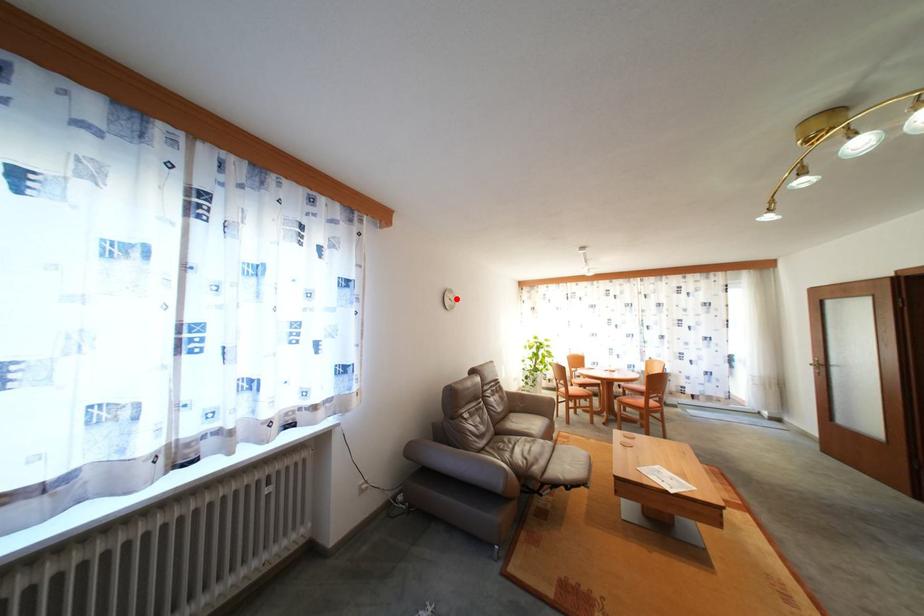
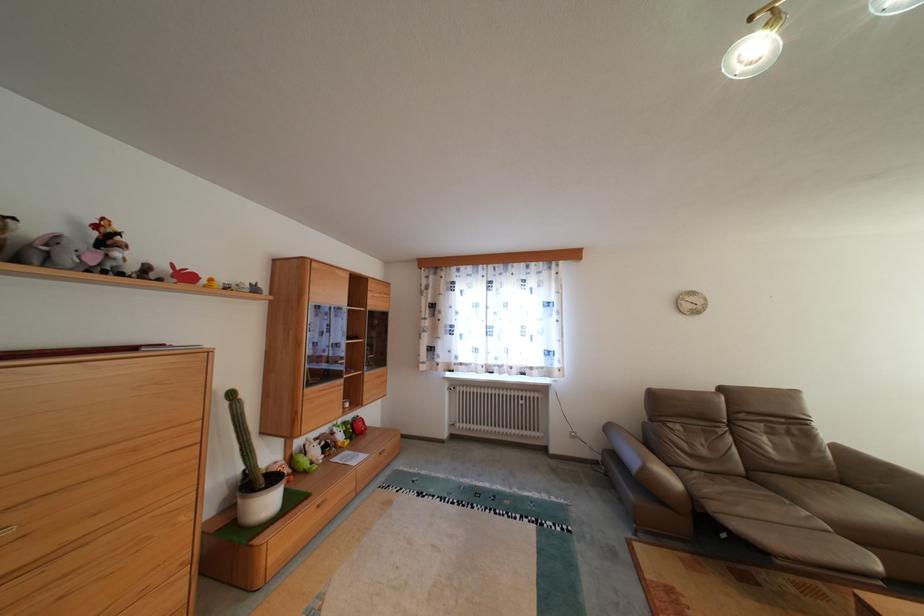
Locate, in the second image, the point that corresponds to the highlighted location in the first image.

(699, 302)